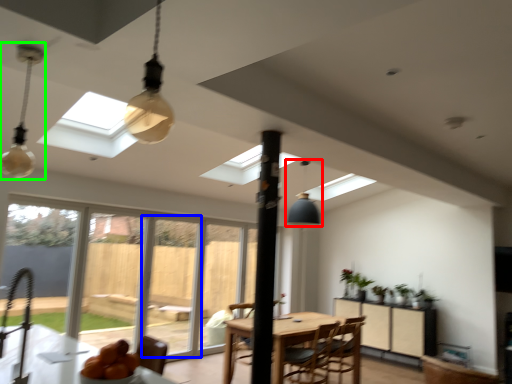
Question: Which object is the closest to the light fixture (highlighted by a red box)? Choose among these: screen door (highlighted by a blue box) or lamp (highlighted by a green box).

Choices:
 (A) screen door
 (B) lamp

Answer: (A)